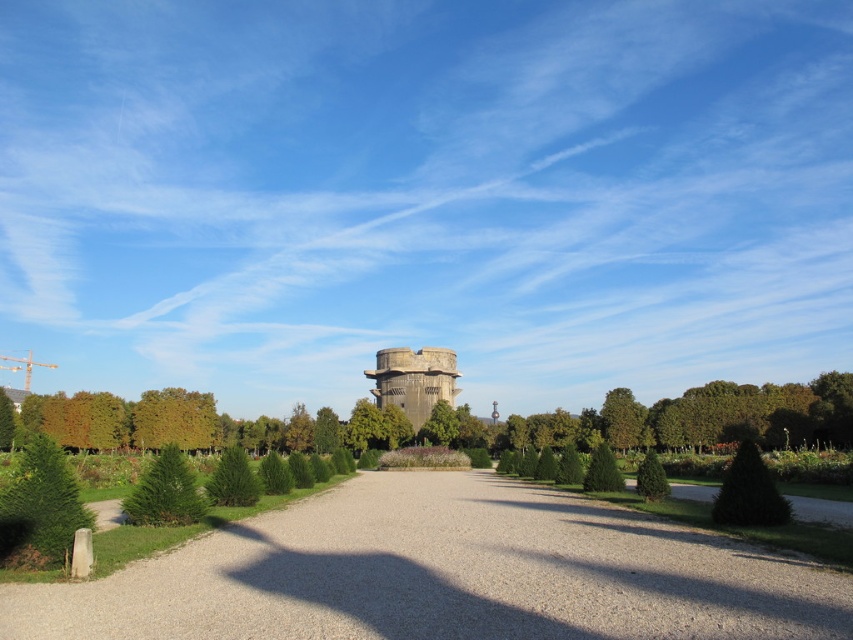
You are standing at the center of the pathway and want to move towards the large cylindrical building in the background. If you look down at your feet, which direction should you move to avoid stepping on the green leafy bush at lower left?

The green leafy bush at lower left is located at point (39, 509), so to avoid stepping on it, you should move away from the lower left direction towards the center of the pathway.

Based on the photo, you are standing at the start of the pathway and want to know the distance between the gray concrete water tower at center and the green leafy tree at left. Can you estimate how far apart they are?

The gray concrete water tower at center is 59.57 meters away from the green leafy tree at left.